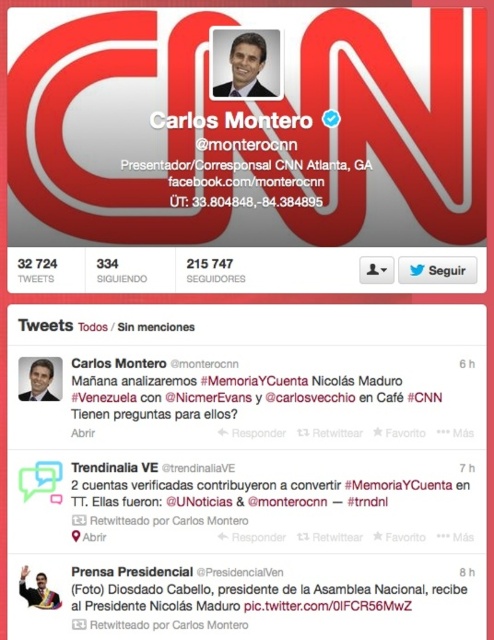
Is white glossy logo at upper center taller than matte black suit at upper center?

Indeed, white glossy logo at upper center has a greater height compared to matte black suit at upper center.

Does white glossy logo at upper center have a smaller size compared to matte black suit at upper center?

Actually, white glossy logo at upper center might be larger than matte black suit at upper center.

Does point (444, 113) come farther from viewer compared to point (255, 92)?

No, (444, 113) is in front of (255, 92).

This screenshot has height=640, width=494. In order to click on white glossy logo at upper center in this screenshot , I will do [x=259, y=132].